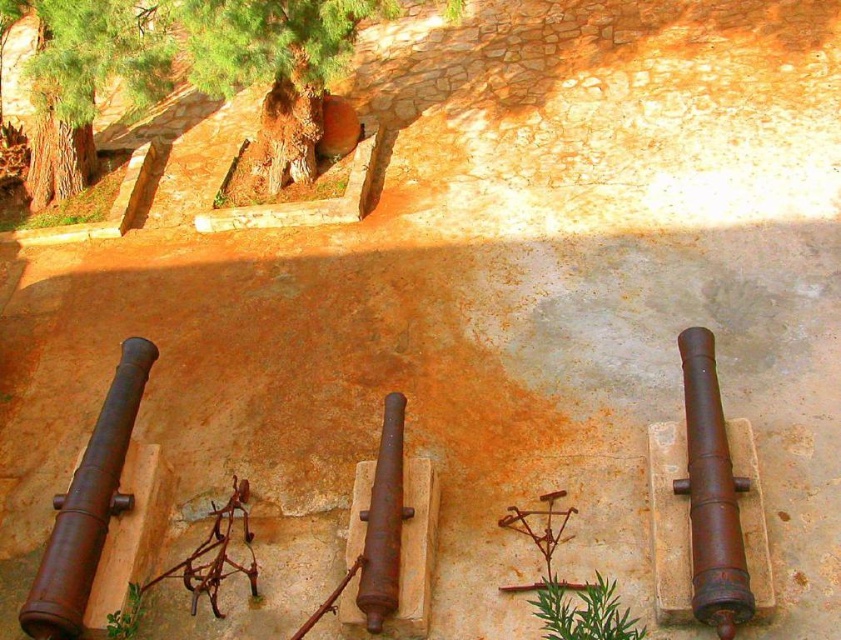
Based on the photo, you are an explorer in this historical area. You need to decide which object to use for shade. Which one is bigger between the green rough bark tree at upper left and the green leafy plant at lower center?

The green rough bark tree at upper left has a larger size compared to the green leafy plant at lower center, so it would provide more shade.

From the picture: You are a gardener who needs to water both the green rough bark tree at upper left and the green leafy plant at lower center. The watering can you have can hold enough water to cover 5 meters. Do you need to refill the watering can before moving from one to the other?

The distance between the green rough bark tree at upper left and the green leafy plant at lower center is 5.22 meters. Since the watering can can only cover 5 meters, you will need to refill it before moving to the other plant.

You are a park ranger measuring distances between landmarks. You see the green rough bark tree at upper left and the rusty metal cannon at right. According to your measurements, which one is farther from the other?

The green rough bark tree at upper left is 5.17 meters away from the rusty metal cannon at right, so they are both the same distance from each other since distance is mutual.